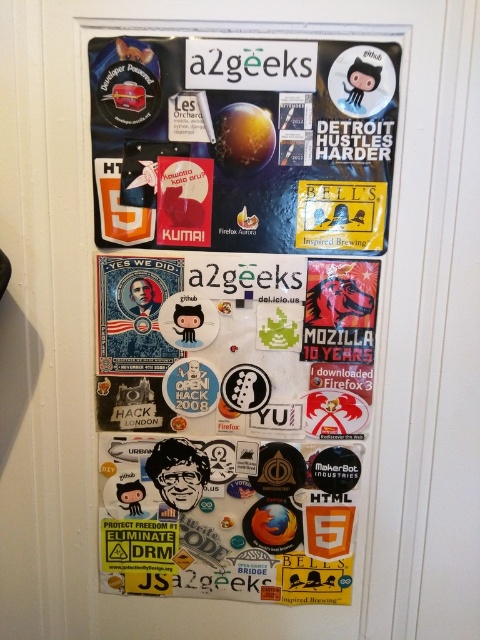
You are trying to hang a new magnet between the multicolored stickers at center and the matte paper poster at upper center. The new magnet is 3 inches long. Will it fit without overlapping either object?

The distance between the multicolored stickers at center and the matte paper poster at upper center is 2.86 inches. Since the new magnet is 3 inches long, it will not fit without overlapping one of the objects.

You are organizing a virtual tour of a tech enthusiast home office. You need to describe the arrangement of the multicolored stickers at center and the matte paper poster at upper center. Which object is positioned higher up on the refrigerator door?

The matte paper poster at upper center is positioned higher up on the refrigerator door than the multicolored stickers at center because the description states that the multicolored stickers at center is much taller as matte paper poster at upper center. Wait, there might be a confusion in the description. Let me check again. The description says the multicolored stickers at center is much taller than the matte paper poster at upper center. Hmm, but the question asks which is higher. If the stickers are at

You are a delivery person trying to place a new sticker on the refrigerator door. The sticker has to be placed behind the existing point at [92,125]. Can you place it at the point [351,300]?

Yes, because point [351,300] is already behind point [92,125] according to the arrangement.